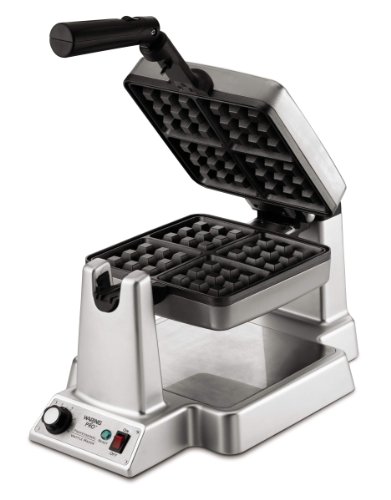
Find the location of a particular element. This screenshot has height=500, width=391. adjuster knob is located at coordinates (64, 416).